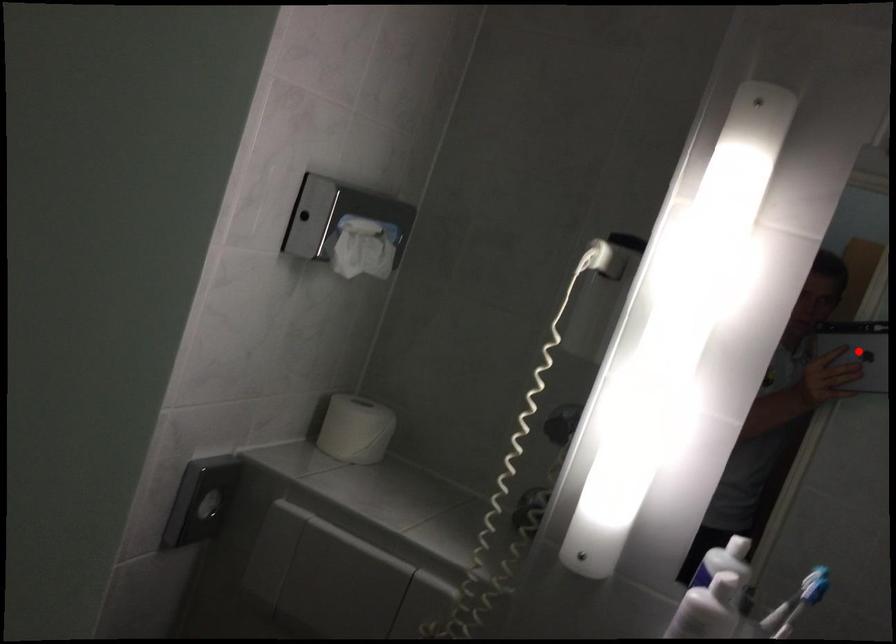
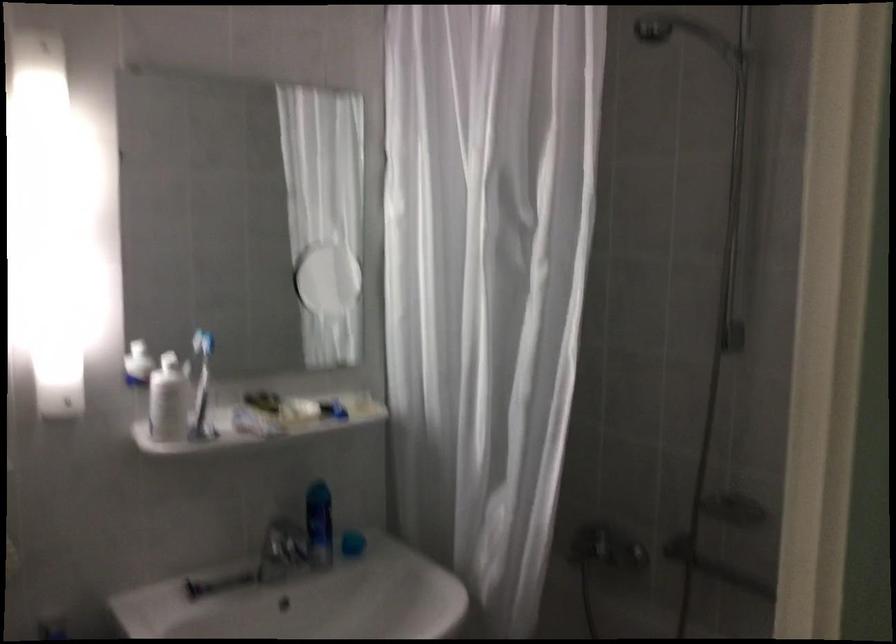
Question: I am providing you with two images of the same scene from different viewpoints. A red point is marked on the first image. At the location where the point appears in image 1, is it still visible in image 2?

Choices:
 (A) Yes
 (B) No

Answer: (B)